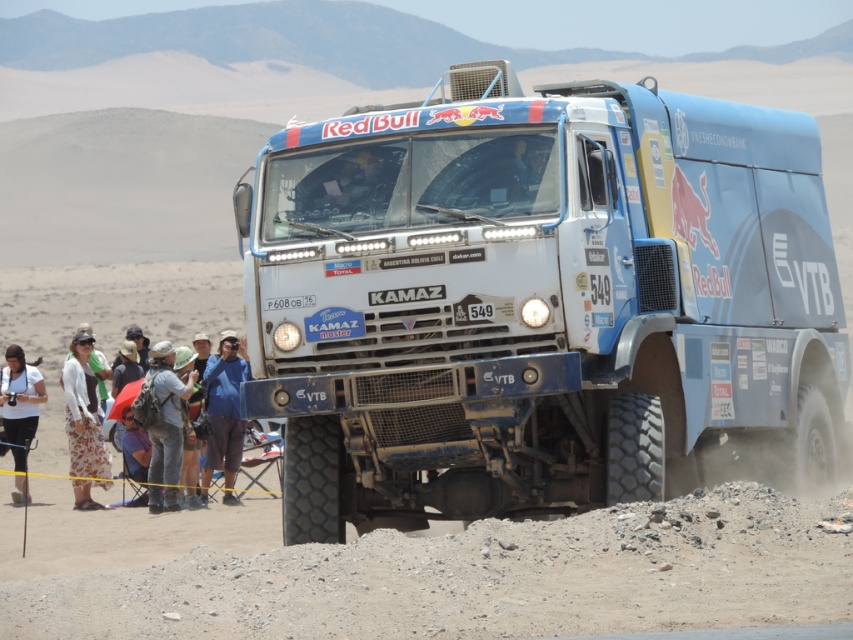
You are a photographer positioned at the lower left of the desert scene. You want to capture a photo of the blue matte truck at center without any obstructions. Is the white cotton shirt at lower left blocking your view of the truck?

The blue matte truck at center is above the white cotton shirt at lower left, so the shirt is not blocking the view. You can take the photo without any obstruction.